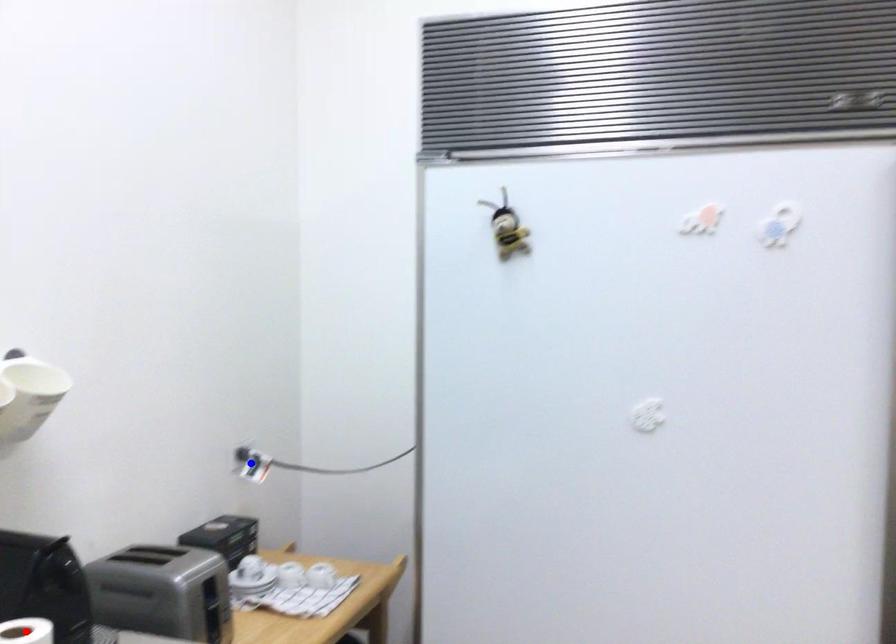
Question: In the image, two points are highlighted. Which point is nearer to the camera? Reply with the corresponding letter.

Choices:
 (A) blue point
 (B) red point

Answer: (B)